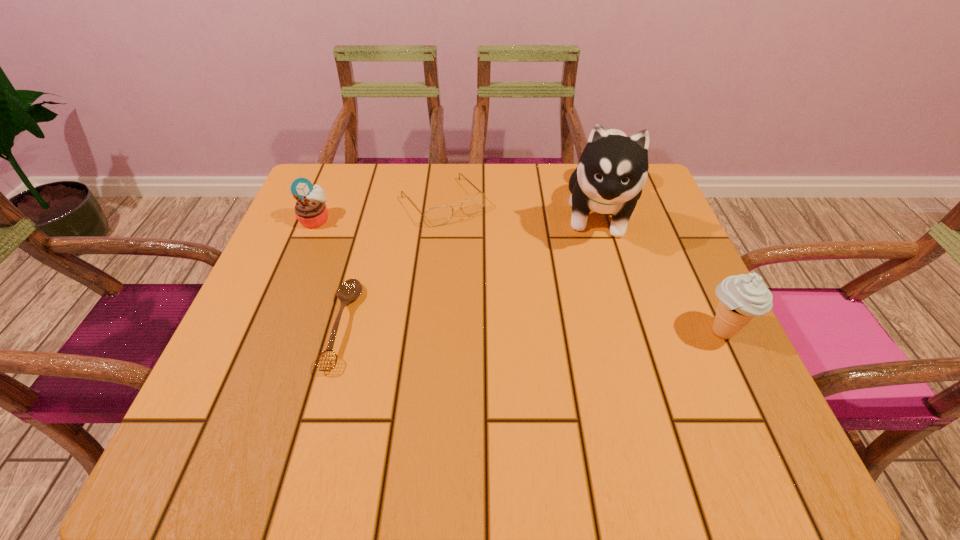
Where is `free space located 0.300m on the right of the shortest object`? The height and width of the screenshot is (540, 960). free space located 0.300m on the right of the shortest object is located at coordinates (512, 326).

What are the coordinates of `vacant space located on the left of the second tallest object` in the screenshot? It's located at (550, 332).

At what (x,y) coordinates should I click in order to perform the action: click on blank area located 0.350m at the face of the tallest object. Please return your answer as a coordinate pair (x, y). The width and height of the screenshot is (960, 540). Looking at the image, I should click on (587, 393).

Identify the location of free region located at the face of the tallest object. (592, 346).

Find the location of a particular element. The width and height of the screenshot is (960, 540). vacant space located at the face of the tallest object is located at coordinates (593, 333).

Identify the location of vacant position located on the front-facing side of the muffin. (406, 271).

The width and height of the screenshot is (960, 540). I want to click on free space located on the front-facing side of the muffin, so click(357, 244).

You are a GUI agent. You are given a task and a screenshot of the screen. Output one action in this format:
    pyautogui.click(x=<x>, y=<y>)
    Task: Click on the vacant area located 0.180m on the front-facing side of the muffin
    
    Given the screenshot: What is the action you would take?
    pyautogui.click(x=379, y=255)

The image size is (960, 540). What are the coordinates of `free location located on the front-facing side of the third object from left to right` in the screenshot? It's located at (561, 339).

Locate an element on the screen. This screenshot has width=960, height=540. free space located 0.300m on the front-facing side of the third object from left to right is located at coordinates (534, 307).